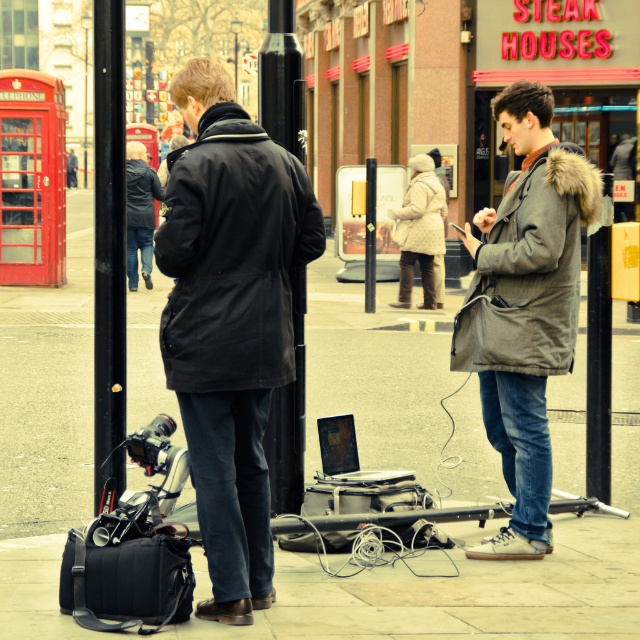
Looking at this image, you are a photographer setting up equipment on the street. You have two poles, the black metal pole at center and the black smooth pole at center. Which pole should you choose if you need a taller one to mount your camera?

The black metal pole at center is much taller than the black smooth pole at center, so you should choose the black metal pole at center for mounting your camera.

You are a photographer setting up equipment on the street. You have two poles, the black metal pole at center and the black smooth pole at center. Which pole should you choose if you need a sturdier support for your camera?

The black metal pole at center is bigger than the black smooth pole at center, so it would provide a sturdier support for your camera.

You are a photographer trying to set up a tripod for a shot. The black smooth pole at center and the silver metallic laptop at center are in your way. Since you need to adjust the height of the tripod to clear both objects, which object requires you to set the tripod higher?

The black smooth pole at center requires you to set the tripod higher because it has a greater height compared to the silver metallic laptop at center.